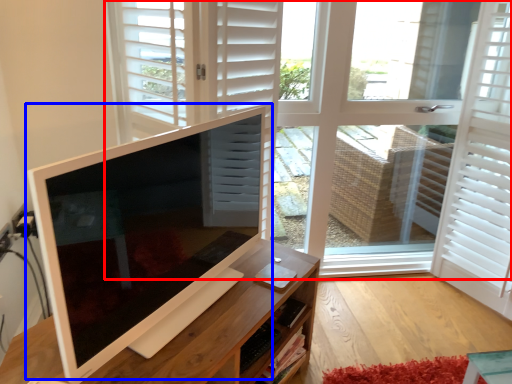
Question: Which object appears farthest to the camera in this image, window (highlighted by a red box) or computer monitor (highlighted by a blue box)?

Choices:
 (A) window
 (B) computer monitor

Answer: (A)